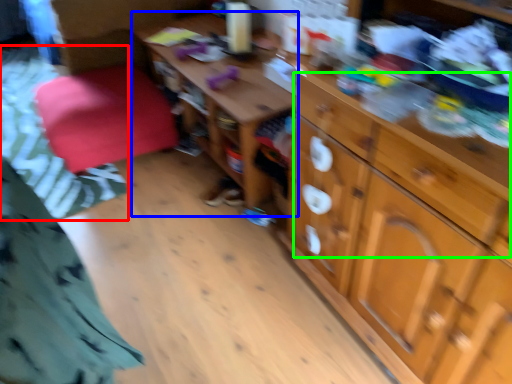
Question: Considering the real-world distances, which object is closest to bedding (highlighted by a red box)? table (highlighted by a blue box) or drawer (highlighted by a green box).

Choices:
 (A) table
 (B) drawer

Answer: (A)